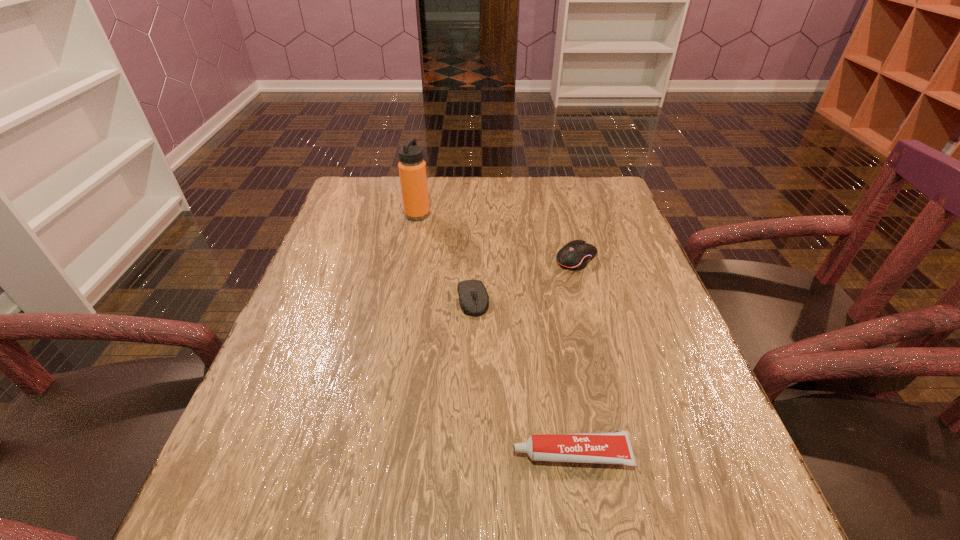
This screenshot has height=540, width=960. I want to click on free spot between the nearest object and the thermos bottle, so point(494,334).

This screenshot has width=960, height=540. In order to click on free space between the right computer equipment and the nearest object in this screenshot , I will do `click(573, 356)`.

This screenshot has height=540, width=960. In order to click on empty space between the third shortest object and the leftmost object in this screenshot , I will do `click(496, 237)`.

At what (x,y) coordinates should I click in order to perform the action: click on vacant space in between the third nearest object and the nearer computer equipment. Please return your answer as a coordinate pair (x, y). Looking at the image, I should click on (524, 279).

At what (x,y) coordinates should I click in order to perform the action: click on vacant space that is in between the farthest object and the second tallest object. Please return your answer as a coordinate pair (x, y). This screenshot has height=540, width=960. Looking at the image, I should click on (496, 237).

The width and height of the screenshot is (960, 540). I want to click on vacant area between the thermos bottle and the second nearest object, so click(445, 257).

Locate an element on the screen. This screenshot has height=540, width=960. unoccupied area between the third shortest object and the toothpaste is located at coordinates (573, 356).

This screenshot has width=960, height=540. In order to click on free space between the farther computer equipment and the leftmost object in this screenshot , I will do `click(496, 237)`.

Locate an element on the screen. The height and width of the screenshot is (540, 960). blank region between the taller computer equipment and the toothpaste is located at coordinates (573, 356).

Identify the location of empty location between the second farthest object and the farthest object. The image size is (960, 540). (496, 237).